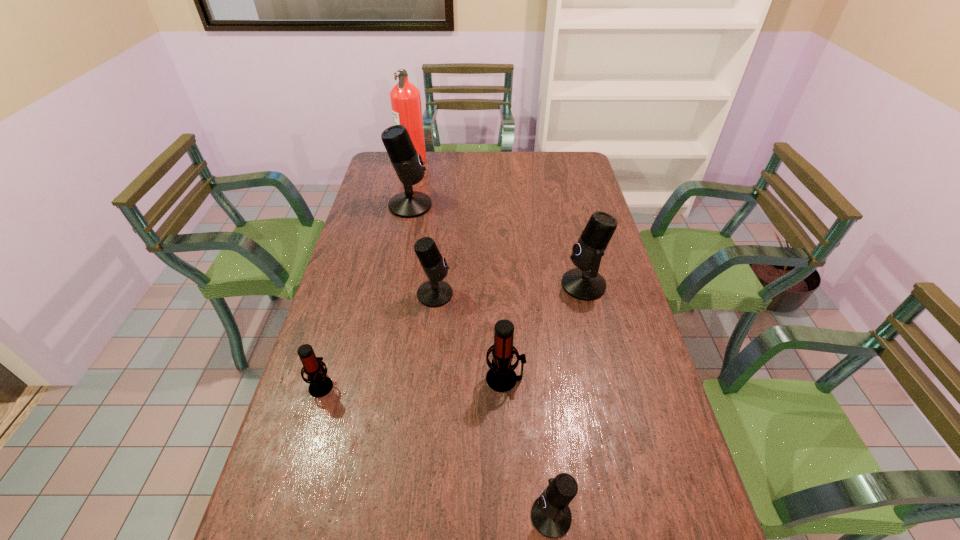
I want to click on blank area in the image that satisfies the following two spatial constraints: 1. at the nozzle of the right red microphone; 2. on the right side of the farthest object, so click(x=365, y=379).